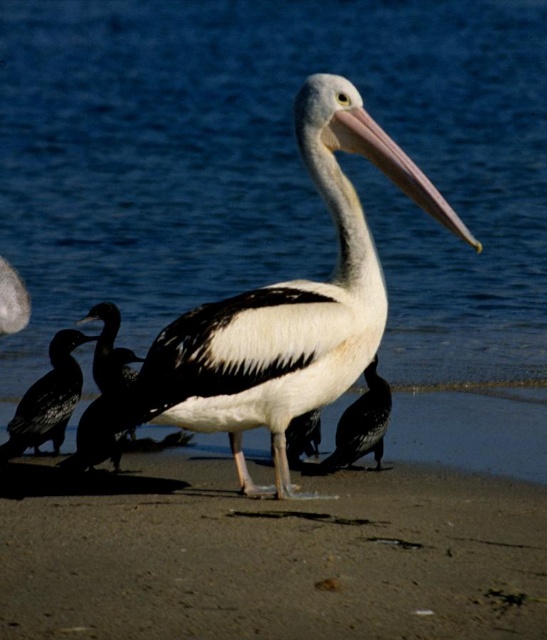
You are a birdwatcher observing the scene. You notice the white glossy pelican at center and the shiny black bird at lower left. Which of these two birds is taller?

The white glossy pelican at center is taller than the shiny black bird at lower left.